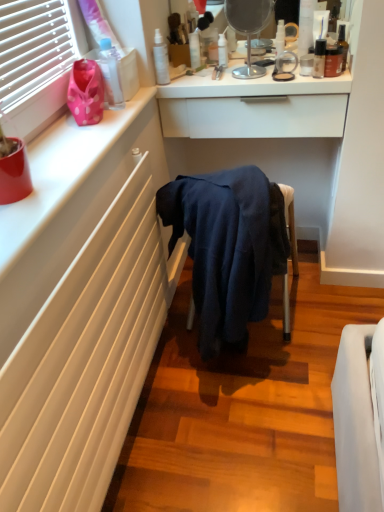
This screenshot has width=384, height=512. What are the coordinates of `vacant region in front of transparent plastic bottle at upper center, arranged as the third toiletry when viewed from the left` in the screenshot? It's located at (208, 77).